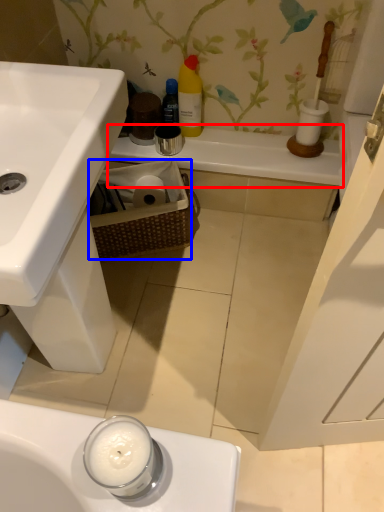
Question: Which of the following is the farthest to the observer, counter top (highlighted by a red box) or basket (highlighted by a blue box)?

Choices:
 (A) counter top
 (B) basket

Answer: (A)